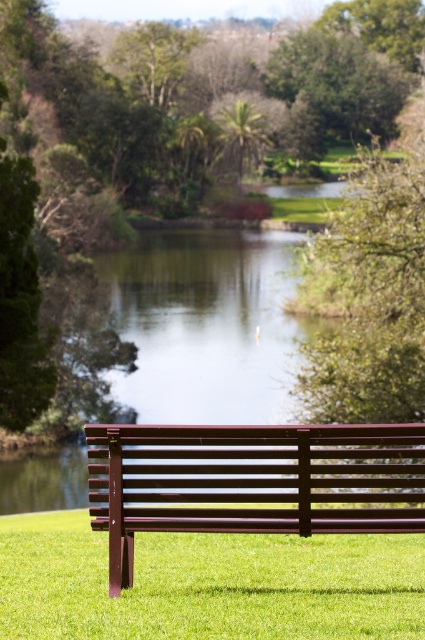
Question: Is green grass at center positioned at the back of metallic brown bench at lower center?

Choices:
 (A) no
 (B) yes

Answer: (A)

Question: In this image, where is green grass at center located relative to metallic brown bench at lower center?

Choices:
 (A) right
 (B) left

Answer: (B)

Question: Is green grass at center bigger than metallic brown bench at lower center?

Choices:
 (A) yes
 (B) no

Answer: (A)